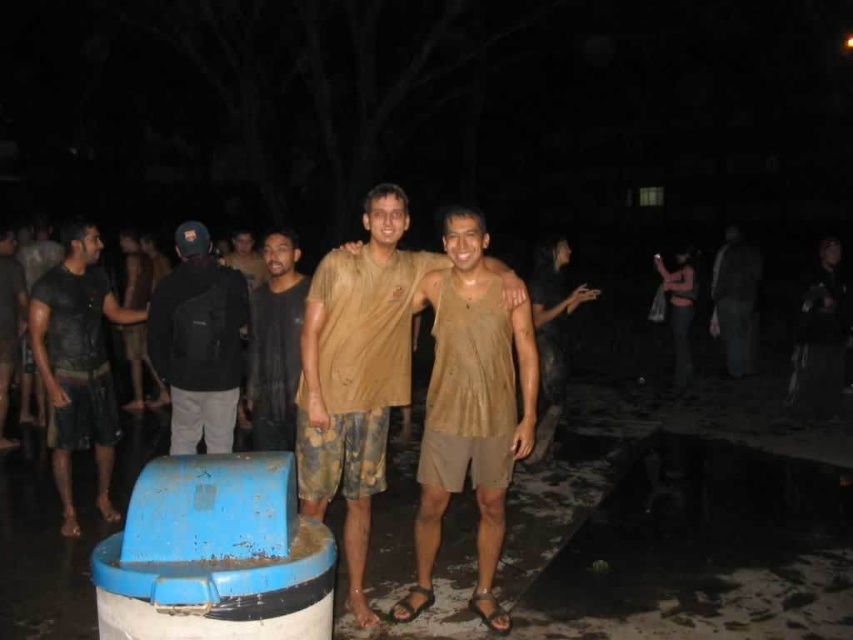
Question: Estimate the real-world distances between objects in this image. Which object is farther from the black fabric backpack at left?

Choices:
 (A) dark brown leather jacket at left
 (B) dark gray fabric pants at right
 (C) brown matte shirt at center
 (D) dark matte t-shirt at left

Answer: (B)

Question: From the image, what is the correct spatial relationship of dark matte t-shirt at left in relation to black fabric backpack at left?

Choices:
 (A) above
 (B) below

Answer: (B)

Question: Considering the real-world distances, which object is closest to the dark brown leather jacket at left?

Choices:
 (A) black fabric backpack at left
 (B) dark brown fabric shirt at center
 (C) brown matte shirt at center
 (D) dark gray fabric pants at right

Answer: (A)

Question: Which object is positioned farthest from the dark gray fabric pants at right?

Choices:
 (A) dark brown leather jacket at left
 (B) black fabric backpack at left
 (C) dark brown fabric shirt at center
 (D) dark matte t-shirt at left

Answer: (A)

Question: Can you confirm if dark gray fabric pants at right is wider than dark brown leather jacket at left?

Choices:
 (A) no
 (B) yes

Answer: (B)

Question: Can you confirm if dark matte t-shirt at left is wider than dark brown leather jacket at left?

Choices:
 (A) no
 (B) yes

Answer: (B)